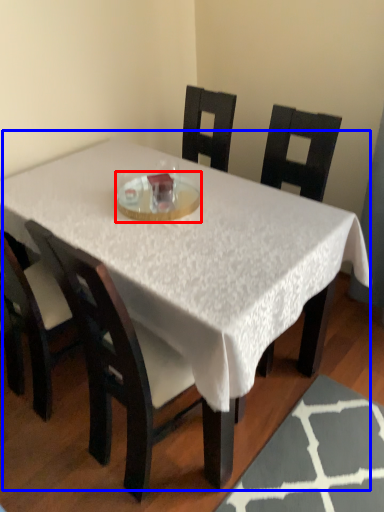
Question: Which point is closer to the camera, glass plate (highlighted by a red box) or table (highlighted by a blue box)?

Choices:
 (A) glass plate
 (B) table

Answer: (B)